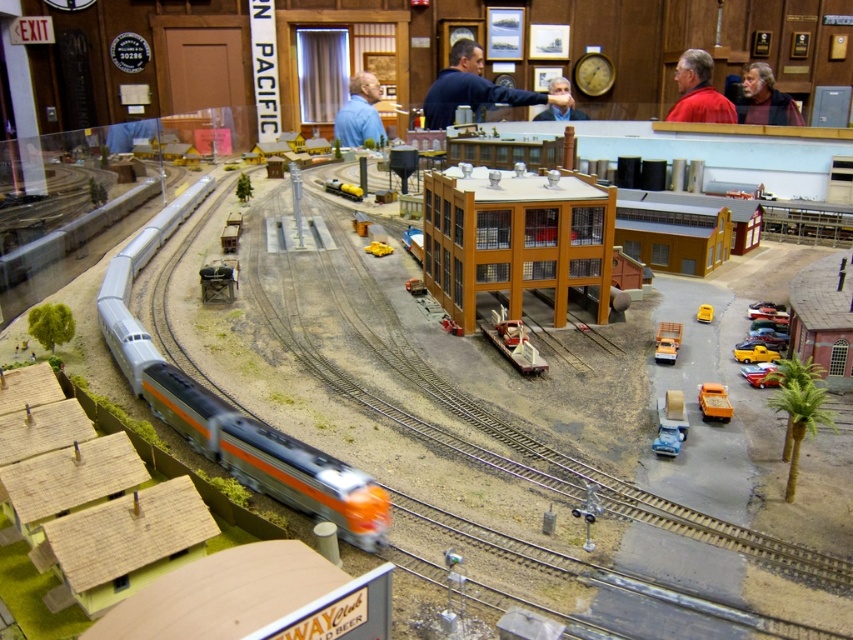
Question: Which of the following is the closest to the observer?

Choices:
 (A) (334, 132)
 (B) (553, 104)
 (C) (782, 124)

Answer: (C)

Question: Which point is farther to the camera?

Choices:
 (A) bearded man at upper right
 (B) blue fabric shirt at center

Answer: (B)

Question: Is dark blue shirt at center below matte black face mask at center?

Choices:
 (A) no
 (B) yes

Answer: (A)

Question: Where is bearded man at upper right located in relation to blue fabric shirt at center in the image?

Choices:
 (A) above
 (B) below

Answer: (B)

Question: Is silver metallic train at lower left further to the viewer compared to dark blue shirt at center?

Choices:
 (A) yes
 (B) no

Answer: (B)

Question: Which point appears closest to the camera in this image?

Choices:
 (A) (550, 113)
 (B) (699, 51)

Answer: (B)